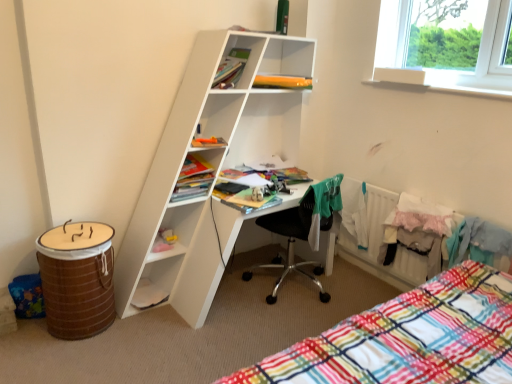
Find the location of a particular element. This screenshot has height=384, width=512. free space on the front side of white matte desk at center is located at coordinates (202, 343).